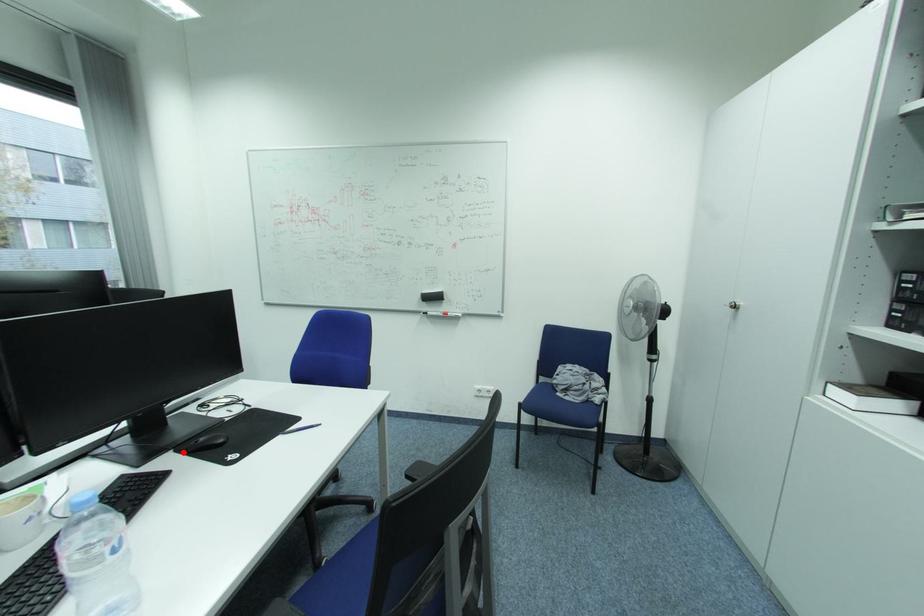
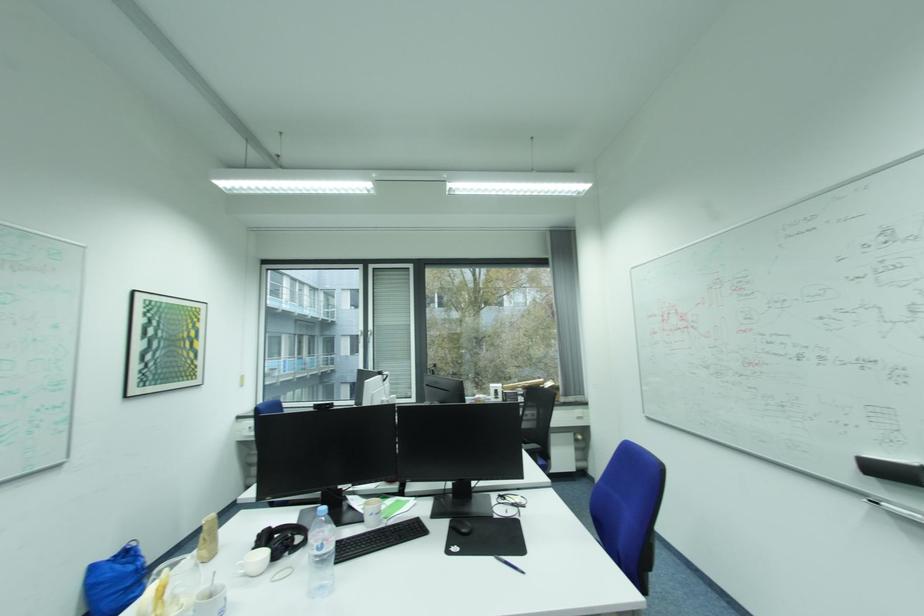
Locate, in the second image, the point that corresponds to the highlighted location in the first image.

(458, 522)